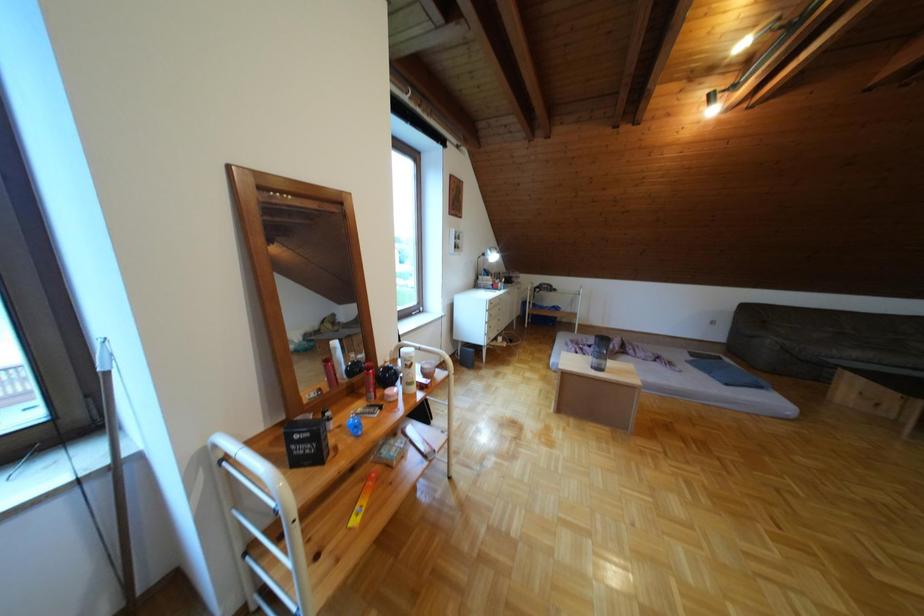
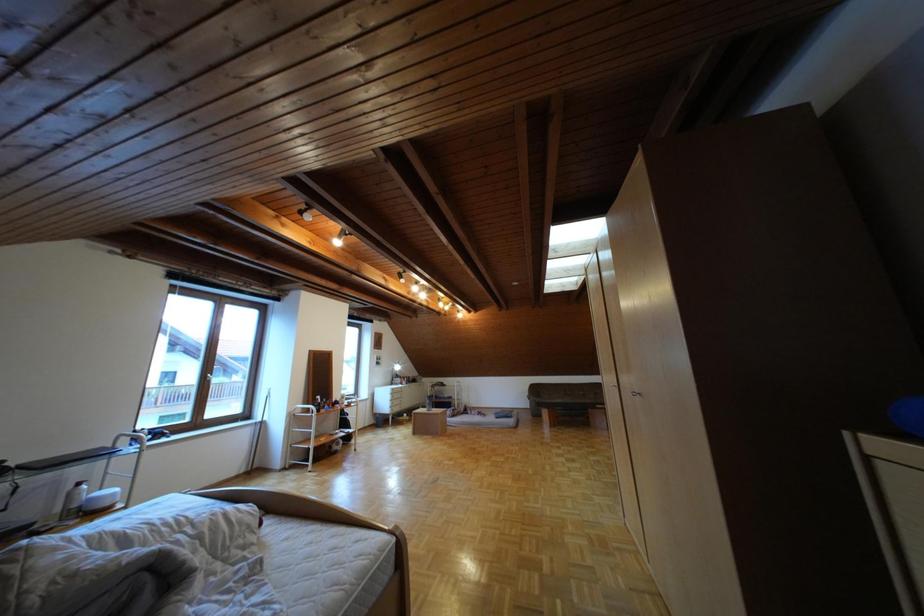
Question: What movement of the cameraman would produce the second image?

Choices:
 (A) Left
 (B) Right
 (C) Forward
 (D) Backward

Answer: (D)